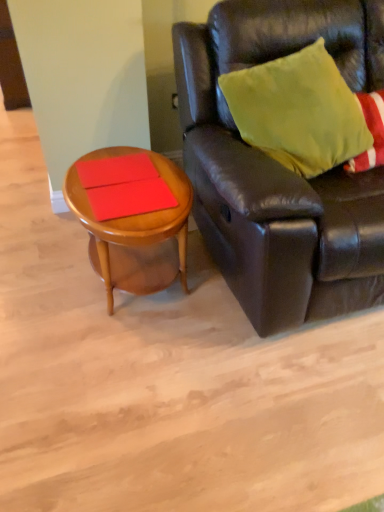
What are the coordinates of `vacant space in matte red book at center, positioned as the second plank in top-to-bottom order (from a real-world perspective)` in the screenshot? It's located at (129, 197).